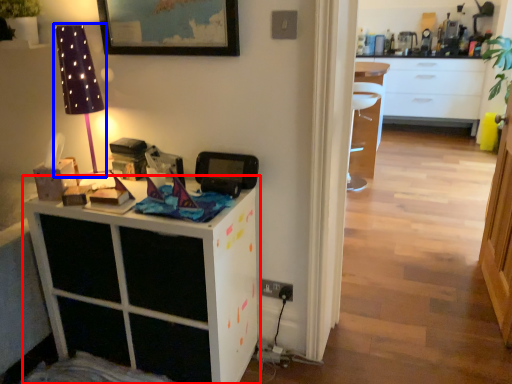
Question: Which of the following is the closest to the observer, cabinetry (highlighted by a red box) or table lamp (highlighted by a blue box)?

Choices:
 (A) cabinetry
 (B) table lamp

Answer: (A)